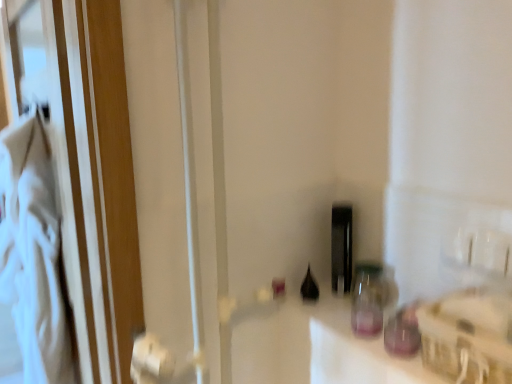
Question: From a real-world perspective, is transparent glass jar at center-right, which is counted as the second bottle, starting from the front, positioned under black glass bottle at center, the 2th bottle positioned from the back, based on gravity?

Choices:
 (A) yes
 (B) no

Answer: (A)

Question: Is transparent glass jar at center-right, acting as the third bottle starting from the back, behind black glass bottle at center, the 3th bottle from the front?

Choices:
 (A) no
 (B) yes

Answer: (A)

Question: Is transparent glass jar at center-right, which is counted as the second bottle, starting from the front, shorter than black glass bottle at center, the 3th bottle from the front?

Choices:
 (A) no
 (B) yes

Answer: (A)

Question: Is transparent glass jar at center-right, which is counted as the second bottle, starting from the front, positioned in front of black glass bottle at center, the 2th bottle positioned from the back?

Choices:
 (A) no
 (B) yes

Answer: (B)

Question: From a real-world perspective, is transparent glass jar at center-right, acting as the third bottle starting from the back, physically located above or below black glass bottle at center, which ranks as the first bottle in back-to-front order?

Choices:
 (A) below
 (B) above

Answer: (A)

Question: In terms of height, does transparent glass jar at center-right, acting as the third bottle starting from the back, look taller or shorter compared to black glass bottle at center, which is the 4th bottle in front-to-back order?

Choices:
 (A) short
 (B) tall

Answer: (A)

Question: Considering their positions, is transparent glass jar at center-right, which is counted as the second bottle, starting from the front, located in front of or behind black glass bottle at center, which ranks as the first bottle in back-to-front order?

Choices:
 (A) behind
 (B) front

Answer: (B)

Question: Would you say transparent glass jar at center-right, which is counted as the second bottle, starting from the front, is inside or outside black glass bottle at center, which ranks as the first bottle in back-to-front order?

Choices:
 (A) outside
 (B) inside

Answer: (A)

Question: Is point (309, 281) positioned closer to the camera than point (348, 205)?

Choices:
 (A) closer
 (B) farther

Answer: (A)

Question: Based on their sizes in the image, would you say black glass bottle at center, the 2th bottle positioned from the back, is bigger or smaller than black glass bottle at center, which ranks as the first bottle in back-to-front order?

Choices:
 (A) small
 (B) big

Answer: (A)

Question: Would you say black glass bottle at center, the 2th bottle positioned from the back, is to the left or to the right of black glass bottle at center, which ranks as the first bottle in back-to-front order, in the picture?

Choices:
 (A) right
 (B) left

Answer: (B)

Question: In the image, is black glass bottle at center, the 2th bottle positioned from the back, positioned in front of or behind black glass bottle at center, which ranks as the first bottle in back-to-front order?

Choices:
 (A) behind
 (B) front

Answer: (B)

Question: Looking at their shapes, would you say transparent glass jar at center-right, which is counted as the second bottle, starting from the front, is wider or thinner than transparent glass bottle at center, which is the 4th bottle from back to front?

Choices:
 (A) thin
 (B) wide

Answer: (B)

Question: Is transparent glass jar at center-right, which is counted as the second bottle, starting from the front, in front of or behind transparent glass bottle at center, the first bottle from the front, in the image?

Choices:
 (A) front
 (B) behind

Answer: (B)